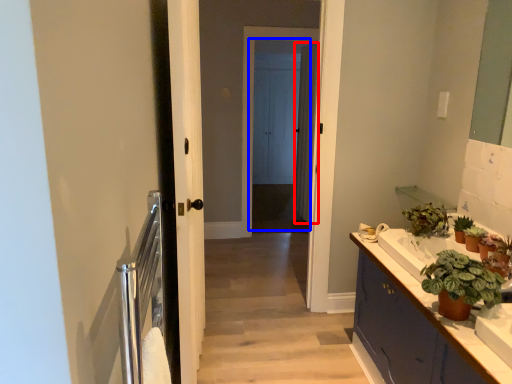
Question: Which object appears farthest to the camera in this image, curtain (highlighted by a red box) or screen door (highlighted by a blue box)?

Choices:
 (A) curtain
 (B) screen door

Answer: (A)